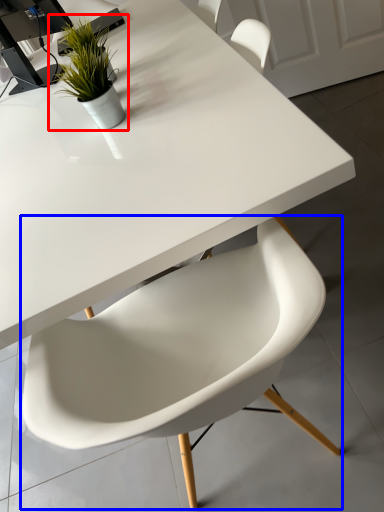
Question: Which point is closer to the camera, houseplant (highlighted by a red box) or chair (highlighted by a blue box)?

Choices:
 (A) houseplant
 (B) chair

Answer: (B)